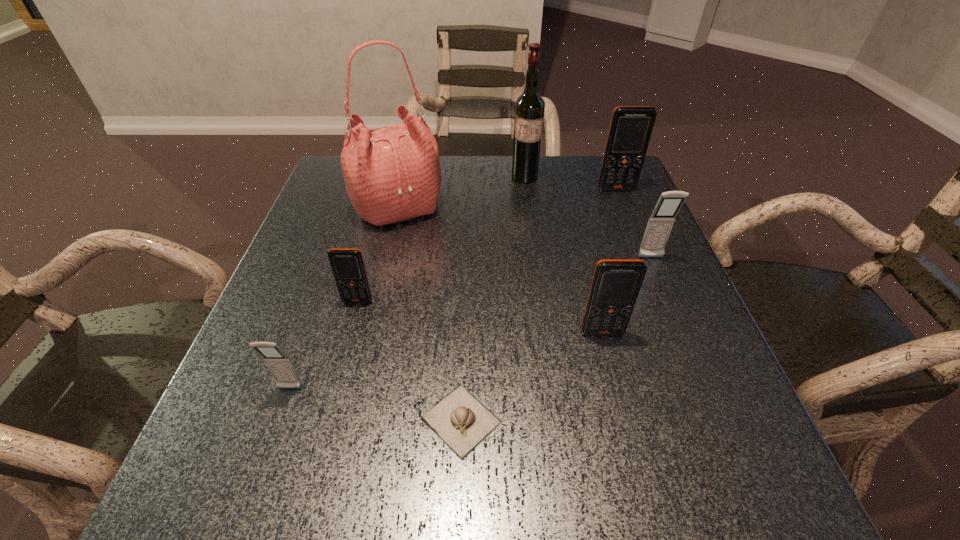
Identify the location of blank area located 0.050m on the front-facing side of the nearer gray cellular telephone. The image size is (960, 540). (278, 421).

You are a GUI agent. You are given a task and a screenshot of the screen. Output one action in this format:
    pyautogui.click(x=<x>, y=<y>)
    Task: Click on the vacant space situated on the left of the shortest object
    The height and width of the screenshot is (540, 960).
    Given the screenshot: What is the action you would take?
    pyautogui.click(x=243, y=420)

Where is `handbag present at the far edge`? The width and height of the screenshot is (960, 540). handbag present at the far edge is located at coordinates (392, 174).

Where is `wine bottle at the far edge`? The width and height of the screenshot is (960, 540). wine bottle at the far edge is located at coordinates (529, 108).

This screenshot has width=960, height=540. Find the location of `cellular telephone that is at the far edge`. cellular telephone that is at the far edge is located at coordinates (630, 130).

Locate an element on the screen. The width and height of the screenshot is (960, 540). object at the near edge is located at coordinates (459, 419).

The width and height of the screenshot is (960, 540). Identify the location of handbag that is at the left edge. (392, 174).

Find the location of a particular element. object situated at the far left corner is located at coordinates (392, 174).

The height and width of the screenshot is (540, 960). I want to click on object at the far right corner, so click(x=630, y=130).

Image resolution: width=960 pixels, height=540 pixels. In the image, there is a desktop. What are the coordinates of `free space at the far edge` in the screenshot? It's located at (570, 175).